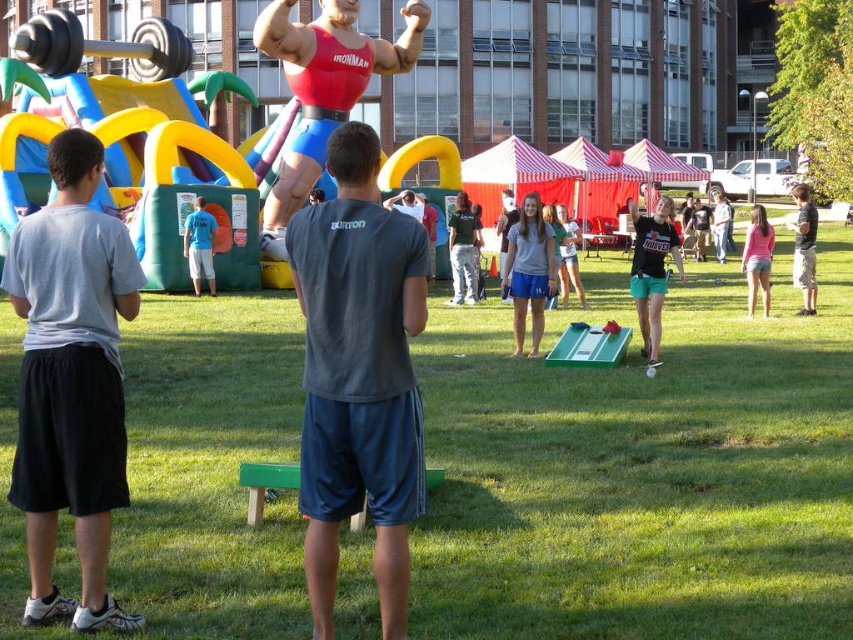
Question: Estimate the real-world distances between objects in this image. Which object is closer to the black matte shirt at center?

Choices:
 (A) blue t-shirt at center
 (B) gray cotton shirt at center

Answer: (B)

Question: Which object is the closest to the dark gray t-shirt at center?

Choices:
 (A) black cotton shirt at right
 (B) black rubber barbell at upper left

Answer: (A)

Question: Does black rubber barbell at upper left appear under black matte shirt at center?

Choices:
 (A) yes
 (B) no

Answer: (B)

Question: Is black cotton shirt at right thinner than pink denim shorts at lower right?

Choices:
 (A) yes
 (B) no

Answer: (A)

Question: Which of these objects is positioned closest to the blue t-shirt at center?

Choices:
 (A) gray cotton t-shirt at left
 (B) green jersey at center
 (C) black matte shirt at center
 (D) pink denim shorts at lower right

Answer: (B)

Question: Can you confirm if gray cotton t-shirt at left is thinner than rubber mannequin at center?

Choices:
 (A) no
 (B) yes

Answer: (B)